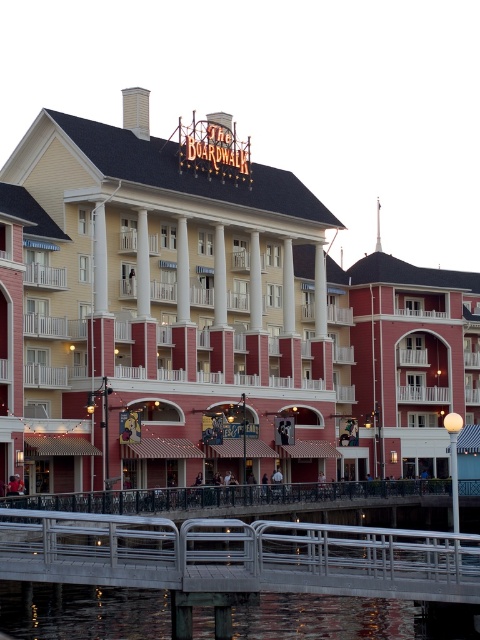
Question: Is yellow siding building at center positioned before transparent water at bridge bottom?

Choices:
 (A) yes
 (B) no

Answer: (B)

Question: Does yellow siding building at center appear over transparent water at bridge bottom?

Choices:
 (A) no
 (B) yes

Answer: (B)

Question: Does yellow siding building at center appear on the left side of silver metallic railing at lower center?

Choices:
 (A) yes
 (B) no

Answer: (A)

Question: Which of the following is the closest to the observer?

Choices:
 (A) silver metallic railing at lower center
 (B) transparent water at bridge bottom
 (C) yellow siding building at center

Answer: (A)

Question: Among these points, which one is nearest to the camera?

Choices:
 (A) [x=59, y=355]
 (B) [x=12, y=552]
 (C) [x=91, y=625]

Answer: (B)

Question: Which point appears farthest from the camera in this image?

Choices:
 (A) click(x=68, y=452)
 (B) click(x=432, y=604)

Answer: (A)